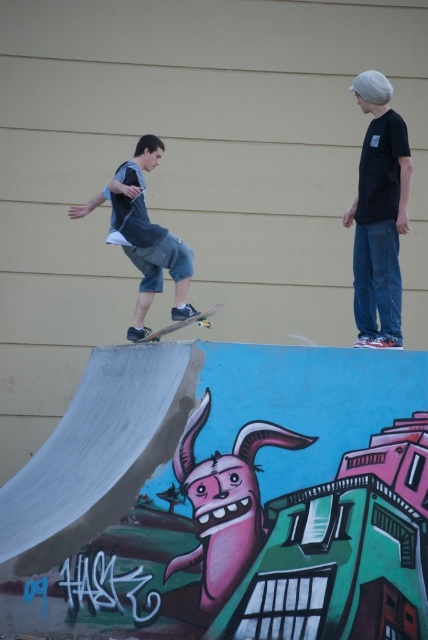
Question: Which object appears farthest from the camera in this image?

Choices:
 (A) wooden skateboard at center
 (B) matte black t-shirt at right

Answer: (A)

Question: Can you confirm if matte black skateboard at center is smaller than wooden skateboard at center?

Choices:
 (A) yes
 (B) no

Answer: (B)

Question: Which point is farther to the camera?

Choices:
 (A) (380, 288)
 (B) (133, 205)
 (C) (196, 310)

Answer: (B)

Question: Which object is positioned closest to the matte black skateboard at center?

Choices:
 (A) wooden skateboard at center
 (B) matte black t-shirt at right

Answer: (A)

Question: Is matte black t-shirt at right to the right of matte black skateboard at center from the viewer's perspective?

Choices:
 (A) no
 (B) yes

Answer: (B)

Question: Does matte black skateboard at center appear on the left side of wooden skateboard at center?

Choices:
 (A) no
 (B) yes

Answer: (B)